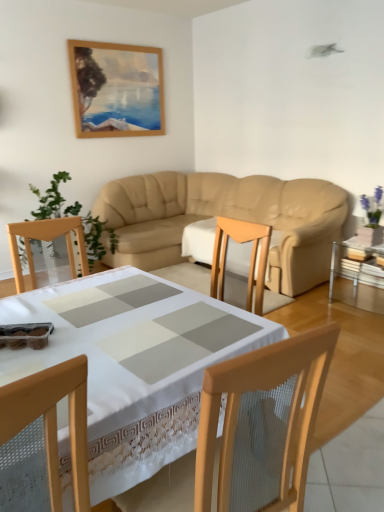
Question: Considering the positions of wooden chair at lower left and clear glass table at right, which is the first table in back-to-front order, in the image, is wooden chair at lower left taller or shorter than clear glass table at right, which is the first table in back-to-front order,?

Choices:
 (A) short
 (B) tall

Answer: (B)

Question: Based on their sizes in the image, would you say wooden chair at lower left is bigger or smaller than clear glass table at right, which is the first table in back-to-front order?

Choices:
 (A) small
 (B) big

Answer: (A)

Question: Estimate the real-world distances between objects in this image. Which object is closer to the white lace tablecloth at center, the 1th table from the left?

Choices:
 (A) wooden chair at lower left
 (B) beige leather couch at center
 (C) clear glass table at right, which is the first table in back-to-front order
 (D) green leafy plant at left

Answer: (A)

Question: Which object is positioned closest to the white lace tablecloth at center, the 2th table positioned from the right?

Choices:
 (A) beige leather couch at center
 (B) clear glass table at right, which ranks as the second table in front-to-back order
 (C) green leafy plant at left
 (D) wooden chair at lower left

Answer: (D)